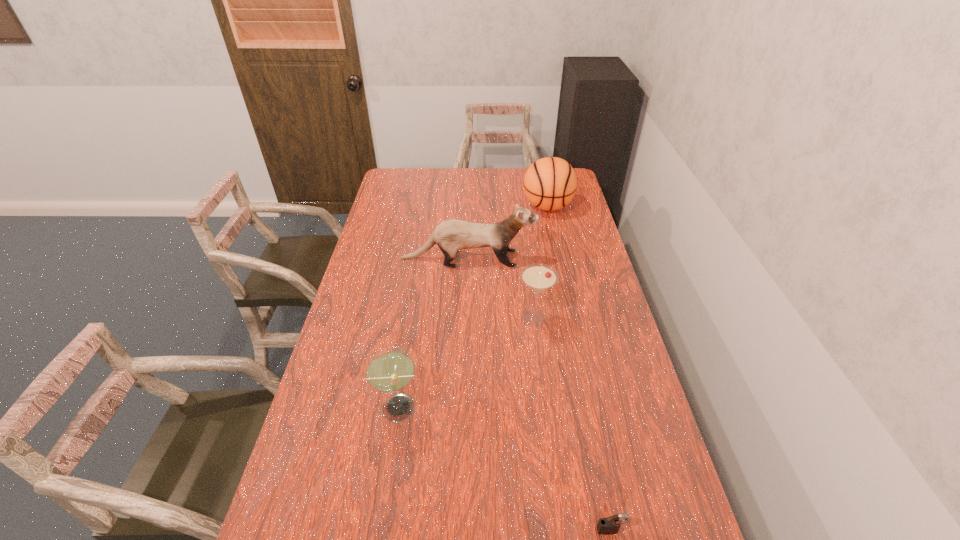
What are the coordinates of `free region located 0.260m on the left of the third farthest object` in the screenshot? It's located at (439, 318).

This screenshot has height=540, width=960. I want to click on free location located on the back of the nearer martini, so click(x=405, y=356).

Find the location of a particular element. This screenshot has height=540, width=960. ferret positioned at the left edge is located at coordinates (451, 236).

Find the location of `martini located in the left edge section of the desktop`. martini located in the left edge section of the desktop is located at coordinates (390, 369).

This screenshot has height=540, width=960. In order to click on basketball located at the right edge in this screenshot , I will do `click(550, 183)`.

You are a GUI agent. You are given a task and a screenshot of the screen. Output one action in this format:
    pyautogui.click(x=<x>, y=<y>)
    Task: Click on the padlock positioned at the right edge
    This screenshot has width=960, height=540.
    Given the screenshot: What is the action you would take?
    pyautogui.click(x=607, y=526)

At what (x,y) coordinates should I click in order to perform the action: click on vacant point at the left edge. Please return your answer as a coordinate pair (x, y). The height and width of the screenshot is (540, 960). Looking at the image, I should click on (369, 286).

This screenshot has width=960, height=540. I want to click on vacant space at the right edge of the desktop, so click(x=618, y=316).

You are a GUI agent. You are given a task and a screenshot of the screen. Output one action in this format:
    pyautogui.click(x=<x>, y=<y>)
    Task: Click on the free location at the far left corner of the desktop
    
    Given the screenshot: What is the action you would take?
    pyautogui.click(x=389, y=171)

Where is `free spot between the third farthest object and the basketball`? free spot between the third farthest object and the basketball is located at coordinates (541, 262).